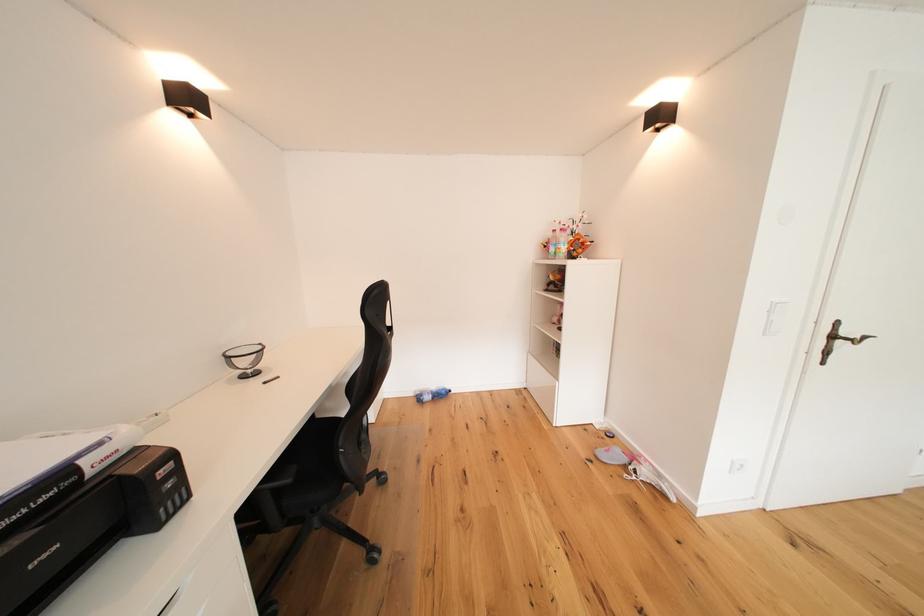
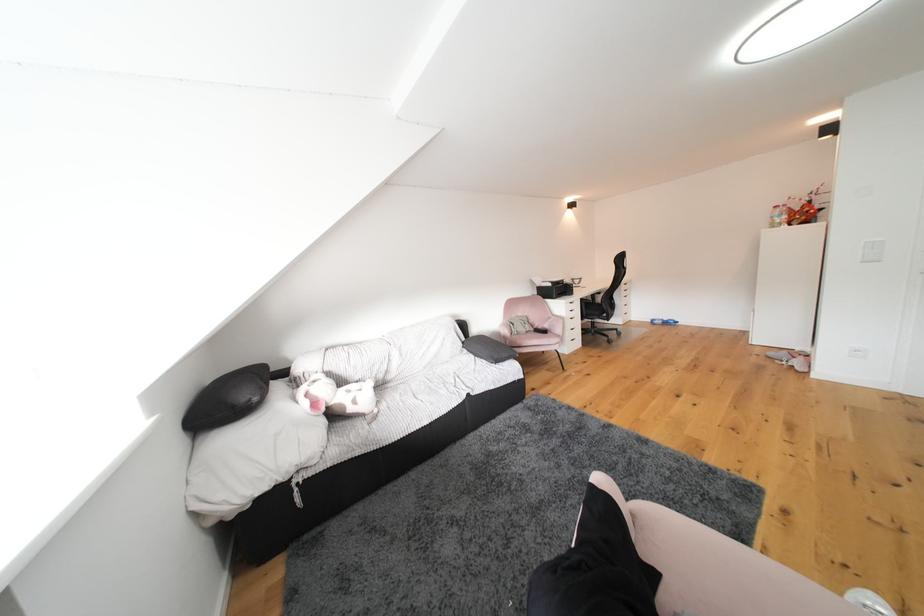
Locate, in the second image, the point that corresponds to the point at 70,476 in the first image.

(572, 285)